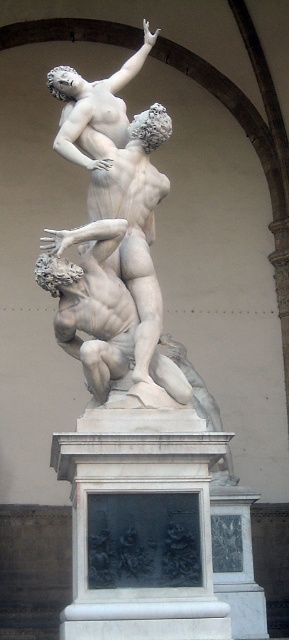
Question: Considering the real-world distances, which object is farthest from the white marble statue at upper center?

Choices:
 (A) white marble relief at center
 (B) white marble statue at center

Answer: (A)

Question: Which of the following is the closest to the observer?

Choices:
 (A) (145, 36)
 (B) (108, 394)

Answer: (B)

Question: Which point is closer to the camera?

Choices:
 (A) white marble relief at center
 (B) white marble statue at upper center
 (C) white marble statue at center

Answer: (A)

Question: Does white marble relief at center appear under white marble statue at upper center?

Choices:
 (A) yes
 (B) no

Answer: (A)

Question: Does white marble relief at center appear on the left side of white marble statue at center?

Choices:
 (A) yes
 (B) no

Answer: (A)

Question: Considering the relative positions of white marble statue at center and white marble statue at upper center in the image provided, where is white marble statue at center located with respect to white marble statue at upper center?

Choices:
 (A) left
 (B) right

Answer: (B)